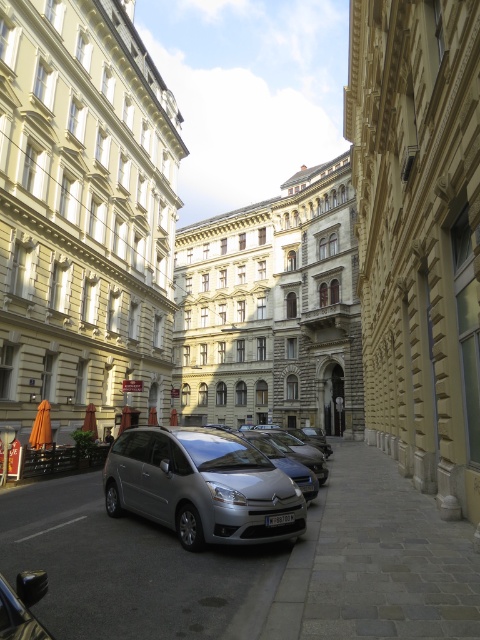
Question: Which point is closer to the camera?

Choices:
 (A) gray stone pavement at center
 (B) satin metallic car at center

Answer: (A)

Question: Can you confirm if gray stone pavement at center is positioned below satin metallic car at center?

Choices:
 (A) yes
 (B) no

Answer: (A)

Question: Which point is farther to the camera?

Choices:
 (A) (154, 484)
 (B) (436, 625)

Answer: (A)

Question: Considering the relative positions of gray stone pavement at center and satin metallic car at center in the image provided, where is gray stone pavement at center located with respect to satin metallic car at center?

Choices:
 (A) right
 (B) left

Answer: (A)

Question: Where is gray stone pavement at center located in relation to satin metallic car at center in the image?

Choices:
 (A) left
 (B) right

Answer: (B)